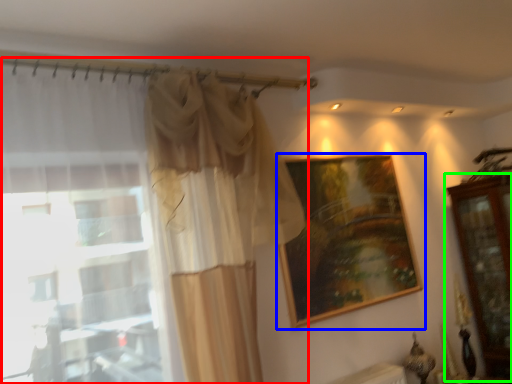
Question: Considering the real-world distances, which object is closest to curtain (highlighted by a red box)? picture frame (highlighted by a blue box) or dresser (highlighted by a green box).

Choices:
 (A) picture frame
 (B) dresser

Answer: (A)